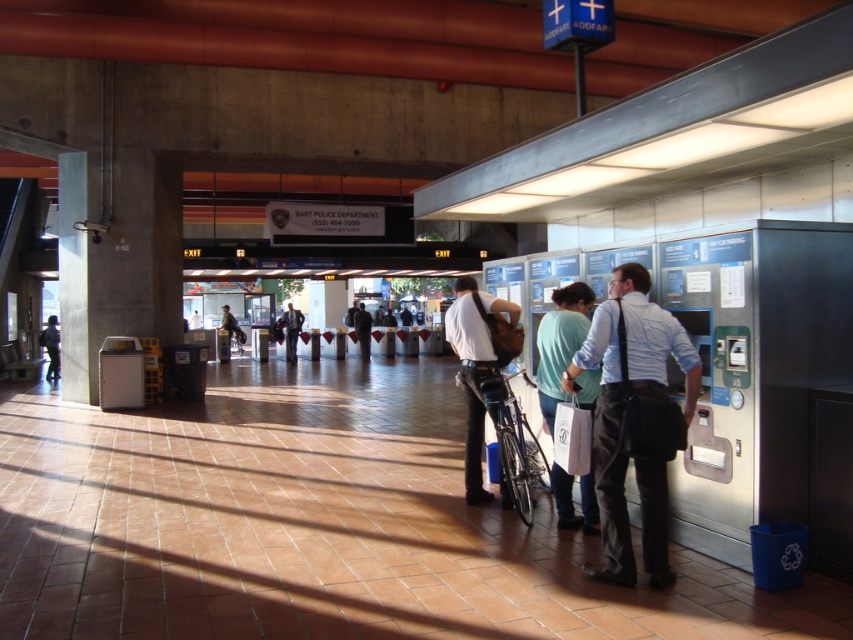
Question: Among these objects, which one is farthest from the camera?

Choices:
 (A) dark blue shirt at center
 (B) dark gray suit at center

Answer: (A)

Question: Does dark gray suit at center have a larger size compared to dark gray uniform at center?

Choices:
 (A) yes
 (B) no

Answer: (A)

Question: Which of these objects is positioned farthest from the light blue shirt at center?

Choices:
 (A) white shirt and dark pants at center
 (B) dark gray uniform at center
 (C) dark blue jeans at lower left

Answer: (B)

Question: Considering the relative positions of light green fabric shirt at center and white shirt and dark pants at center in the image provided, where is light green fabric shirt at center located with respect to white shirt and dark pants at center?

Choices:
 (A) above
 (B) below

Answer: (A)

Question: Does dark blue jeans at lower left come in front of dark blue shirt at center?

Choices:
 (A) no
 (B) yes

Answer: (B)

Question: Considering the real-world distances, which object is closest to the white shirt and dark pants at center?

Choices:
 (A) light blue shirt at center
 (B) dark blue jeans at lower left
 (C) light green fabric shirt at center
 (D) dark gray suit at center

Answer: (C)